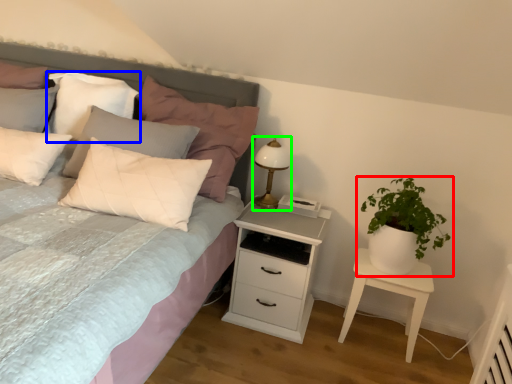
Question: Based on their relative distances, which object is farther from houseplant (highlighted by a red box)? Choose from pillow (highlighted by a blue box) and bedside lamp (highlighted by a green box).

Choices:
 (A) pillow
 (B) bedside lamp

Answer: (A)